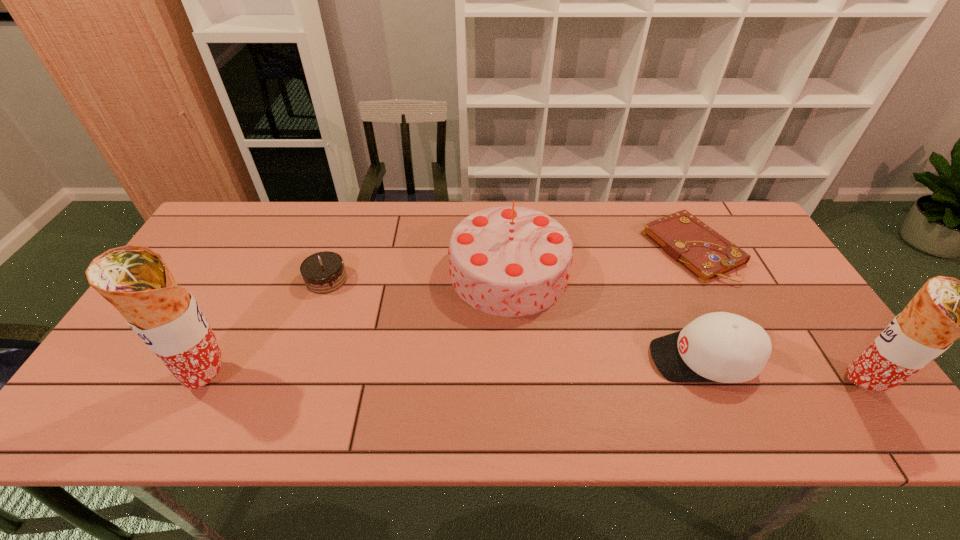
Locate an element on the screen. This screenshot has height=540, width=960. vacant region between the shorter burrito and the shortest object is located at coordinates (777, 317).

Locate an element on the screen. The height and width of the screenshot is (540, 960). vacant space in between the fourth tallest object and the taller burrito is located at coordinates (456, 369).

You are a GUI agent. You are given a task and a screenshot of the screen. Output one action in this format:
    pyautogui.click(x=<x>, y=<y>)
    Task: Click on the unoccupied position between the baseball cap and the third tallest object
    Image resolution: width=960 pixels, height=540 pixels.
    Given the screenshot: What is the action you would take?
    pyautogui.click(x=606, y=316)

This screenshot has width=960, height=540. Identify the location of empty location between the leftmost object and the chocolate cake. (268, 328).

Find the location of a particular element. The width and height of the screenshot is (960, 540). vacant space that's between the rightmost object and the shortest object is located at coordinates (777, 317).

You are a GUI agent. You are given a task and a screenshot of the screen. Output one action in this format:
    pyautogui.click(x=<x>, y=<y>)
    Task: Click on the free area in between the notebook and the birthday cake
    The image size is (960, 540).
    Given the screenshot: What is the action you would take?
    pyautogui.click(x=601, y=261)

At what (x,y) coordinates should I click in order to perform the action: click on vacant area between the fifth shortest object and the chocolate cake. Please return your answer as a coordinate pair (x, y). This screenshot has height=540, width=960. Looking at the image, I should click on (594, 332).

Where is `the third closest object to the chocolate cake`? The image size is (960, 540). the third closest object to the chocolate cake is located at coordinates (724, 347).

This screenshot has height=540, width=960. I want to click on object that is the closest one to the third object from left to right, so click(724, 347).

Find the location of a particular element. vacant region that satisfies the following two spatial constraints: 1. on the back side of the shorter burrito; 2. on the front-facing side of the baseball cap is located at coordinates (844, 359).